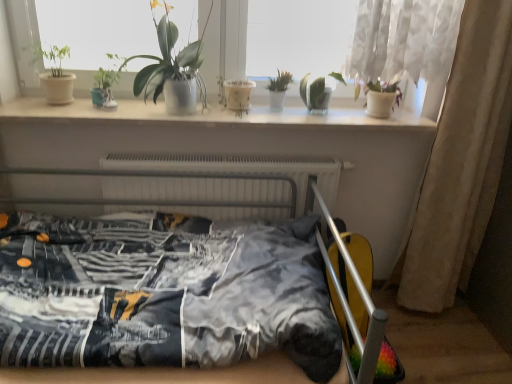
Question: Do you think white sheer curtain at right is within white metallic radiator at center, or outside of it?

Choices:
 (A) inside
 (B) outside

Answer: (B)

Question: Is white sheer curtain at right wider or thinner than white metallic radiator at center?

Choices:
 (A) thin
 (B) wide

Answer: (B)

Question: Based on their relative distances, which object is nearer to the white glossy window sill at upper center?

Choices:
 (A) green matte plant at center, the second houseplant when ordered from right to left
 (B) pink matte orchid at upper right
 (C) green glossy plant at upper center, the 3th houseplant from the left
 (D) white metallic radiator at center
 (E) white sheer curtain at right

Answer: (C)

Question: Which object is positioned farthest from the white glossy window sill at upper center?

Choices:
 (A) white metallic radiator at center
 (B) green matte plant at center, the second houseplant when ordered from right to left
 (C) translucent glass vase at upper center, which appears as the 1th houseplant when viewed from the right
 (D) pink matte orchid at upper right
 (E) printed fabric bed at center

Answer: (D)